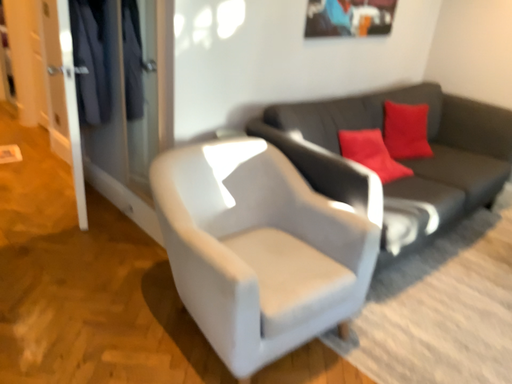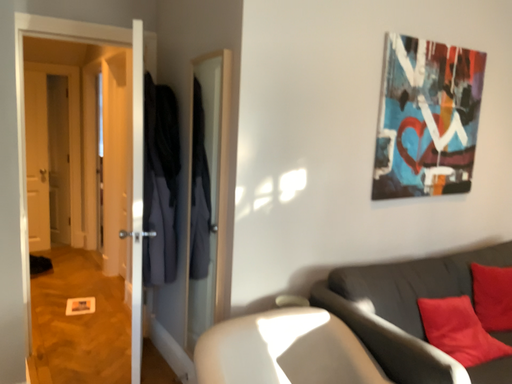
Question: Which way did the camera rotate in the video?

Choices:
 (A) rotated upward
 (B) rotated downward

Answer: (A)